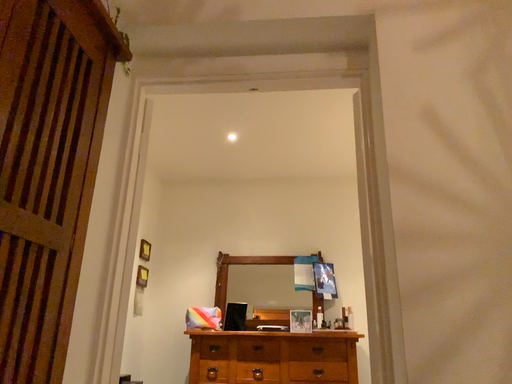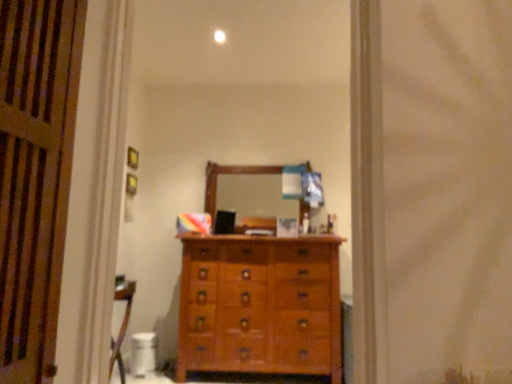
Question: How did the camera likely rotate when shooting the video?

Choices:
 (A) rotated upward
 (B) rotated downward

Answer: (B)